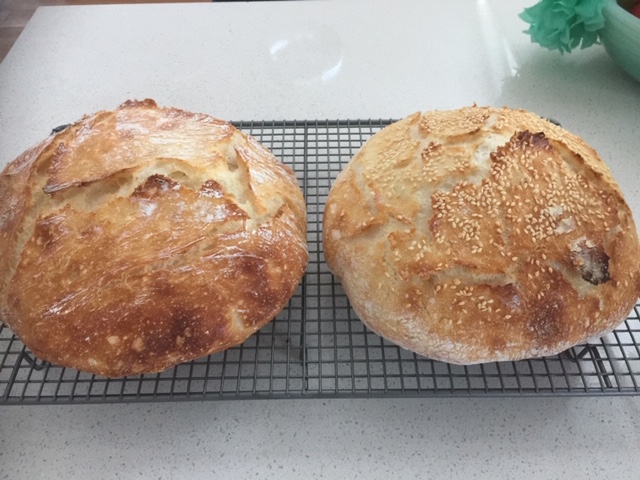
Locate an element on the screen. This screenshot has height=480, width=640. counter is located at coordinates (257, 445), (294, 46).